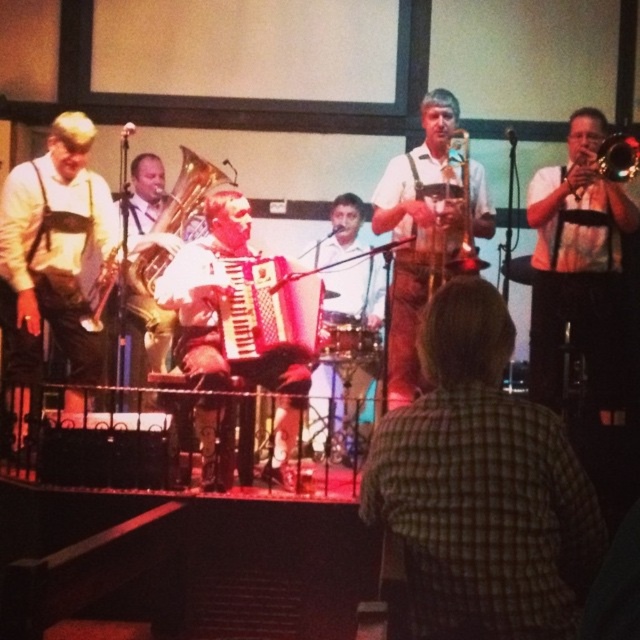
Does white leather pants at center appear under white textured accordion at center?

Incorrect, white leather pants at center is not positioned below white textured accordion at center.

Does white leather pants at center appear on the right side of white textured accordion at center?

No, white leather pants at center is not to the right of white textured accordion at center.

Does point (10, 269) come closer to viewer compared to point (266, 298)?

No, (10, 269) is further to viewer.

Find the location of a particular element. The height and width of the screenshot is (640, 640). white leather pants at center is located at coordinates (54, 262).

Between white textured accordion at center and gold brass trumpet at upper right, which one appears on the right side from the viewer's perspective?

Positioned to the right is gold brass trumpet at upper right.

Based on the photo, who is shorter, white textured accordion at center or gold brass trumpet at upper right?

gold brass trumpet at upper right

What do you see at coordinates (269, 308) in the screenshot?
I see `white textured accordion at center` at bounding box center [269, 308].

Image resolution: width=640 pixels, height=640 pixels. I want to click on white textured accordion at center, so click(269, 308).

Looking at this image, can you confirm if green plaid shirt at center is positioned above wooden saxophone at center?

No, green plaid shirt at center is not above wooden saxophone at center.

Does green plaid shirt at center appear on the right side of wooden saxophone at center?

In fact, green plaid shirt at center is to the left of wooden saxophone at center.

Locate an element on the screen. The image size is (640, 640). green plaid shirt at center is located at coordinates (481, 486).

What are the coordinates of `green plaid shirt at center` in the screenshot? It's located at (481, 486).